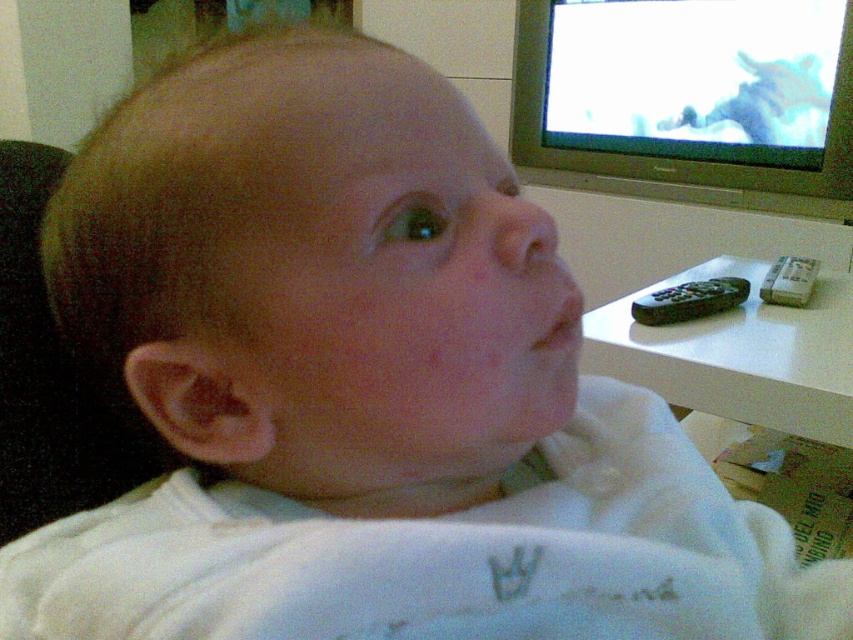
You are a parent trying to place a small toy on the white plastic table at right and the silver plastic television at upper right. Which surface can the toy be placed on without it being too high?

The white plastic table at right is shorter than the silver plastic television at upper right, so placing the toy on the white plastic table at right would be lower and safer.

You are designing a layout for a baby nursery and need to place a silver plastic television at upper right. According to the image, what are the coordinates for placing the television?

The coordinates for placing the silver plastic television at upper right are at point (x=675, y=140).

You are a photographer taking a picture of the baby in the living room. You notice a point at coordinates (740, 355). Where is this point located in relation to the white plastic table at right?

The point at coordinates (740, 355) is located on the white plastic table at right.